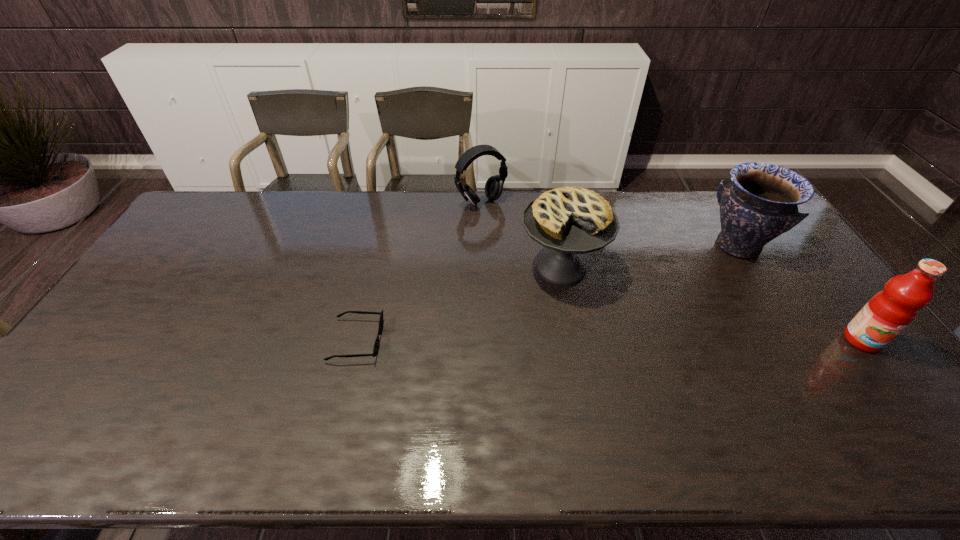
Find the location of a particular element. The height and width of the screenshot is (540, 960). vacant space on the desktop that is between the leftmost object and the rightmost object and is positioned on the ear cups of the second object from left to right is located at coordinates (606, 340).

The height and width of the screenshot is (540, 960). In order to click on vacant space on the desktop that is between the sunglasses and the rightmost object and is positioned on the front handle of the pottery in this screenshot , I will do `click(660, 340)`.

This screenshot has width=960, height=540. In order to click on free space on the desktop that is between the sunglasses and the rightmost object and is positioned on the cut side of the third object from right to left in this screenshot , I will do `click(547, 340)`.